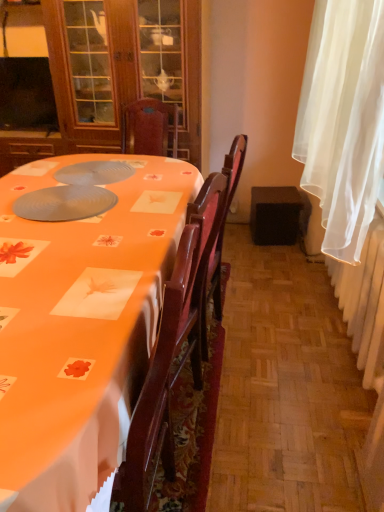
Question: Can you confirm if white sheer curtain at right is taller than matte gray paper plate at center?

Choices:
 (A) no
 (B) yes

Answer: (B)

Question: Is white sheer curtain at right looking in the opposite direction of matte gray paper plate at center?

Choices:
 (A) no
 (B) yes

Answer: (A)

Question: From the image's perspective, is white sheer curtain at right beneath matte gray paper plate at center?

Choices:
 (A) yes
 (B) no

Answer: (B)

Question: Does white sheer curtain at right turn towards matte gray paper plate at center?

Choices:
 (A) no
 (B) yes

Answer: (B)

Question: Does white sheer curtain at right appear on the left side of matte gray paper plate at center?

Choices:
 (A) yes
 (B) no

Answer: (B)

Question: Can you confirm if white sheer curtain at right is bigger than matte gray paper plate at center?

Choices:
 (A) yes
 (B) no

Answer: (A)

Question: From a real-world perspective, is matte gray paper plate at center on top of black fabric speaker at lower right?

Choices:
 (A) no
 (B) yes

Answer: (B)

Question: Is black fabric speaker at lower right completely or partially inside matte gray paper plate at center?

Choices:
 (A) no
 (B) yes

Answer: (A)

Question: Does matte gray paper plate at center have a lesser width compared to black fabric speaker at lower right?

Choices:
 (A) no
 (B) yes

Answer: (A)

Question: Is matte gray paper plate at center wider than black fabric speaker at lower right?

Choices:
 (A) yes
 (B) no

Answer: (A)

Question: Does matte gray paper plate at center have a greater height compared to black fabric speaker at lower right?

Choices:
 (A) yes
 (B) no

Answer: (B)

Question: From the image's perspective, is matte gray paper plate at center below black fabric speaker at lower right?

Choices:
 (A) yes
 (B) no

Answer: (A)

Question: Is white sheer curtain at right a part of black fabric speaker at lower right?

Choices:
 (A) no
 (B) yes

Answer: (A)